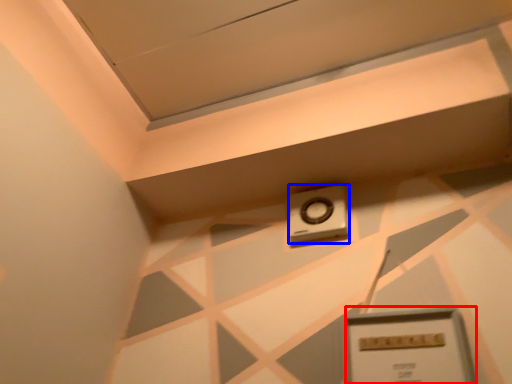
Question: Which of the following is the closest to the observer, rectangle (highlighted by a red box) or alarm (highlighted by a blue box)?

Choices:
 (A) rectangle
 (B) alarm

Answer: (A)